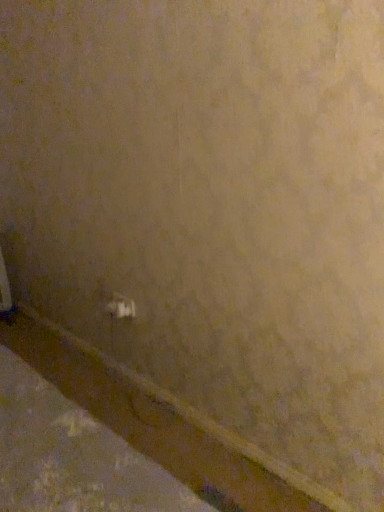
Identify the location of white matte molding at lower left. This screenshot has width=384, height=512. (159, 424).

What do you see at coordinates (159, 424) in the screenshot?
I see `white matte molding at lower left` at bounding box center [159, 424].

Image resolution: width=384 pixels, height=512 pixels. What do you see at coordinates (121, 307) in the screenshot?
I see `white plastic power plugs and sockets at lower center` at bounding box center [121, 307].

The width and height of the screenshot is (384, 512). Identify the location of white plastic power plugs and sockets at lower center. (121, 307).

At what (x,y) coordinates should I click in order to perform the action: click on white matte molding at lower left. Please return your answer as a coordinate pair (x, y). Looking at the image, I should click on (159, 424).

Would you say white matte molding at lower left is to the left or to the right of white plastic power plugs and sockets at lower center in the picture?

white matte molding at lower left is positioned on white plastic power plugs and sockets at lower center's left side.

Which is in front, white matte molding at lower left or white plastic power plugs and sockets at lower center?

white matte molding at lower left is closer to the camera.

Considering the positions of point (167, 403) and point (114, 304), is point (167, 403) closer or farther from the camera than point (114, 304)?

Point (167, 403) is closer to the camera than point (114, 304).

From the image's perspective, who appears lower, white matte molding at lower left or white plastic power plugs and sockets at lower center?

From the image's view, white matte molding at lower left is below.

From a real-world perspective, which is physically below, white matte molding at lower left or white plastic power plugs and sockets at lower center?

white matte molding at lower left, from a real-world perspective.

Considering the relative sizes of white matte molding at lower left and white plastic power plugs and sockets at lower center in the image provided, is white matte molding at lower left wider than white plastic power plugs and sockets at lower center?

Yes, white matte molding at lower left is wider than white plastic power plugs and sockets at lower center.

Is white matte molding at lower left taller than white plastic power plugs and sockets at lower center?

No, white matte molding at lower left is not taller than white plastic power plugs and sockets at lower center.

Is white matte molding at lower left bigger than white plastic power plugs and sockets at lower center?

Yes.

Is white matte molding at lower left completely or partially outside of white plastic power plugs and sockets at lower center?

Indeed, white matte molding at lower left is completely outside white plastic power plugs and sockets at lower center.

Is white matte molding at lower left placed right next to white plastic power plugs and sockets at lower center?

There is a gap between white matte molding at lower left and white plastic power plugs and sockets at lower center.

Is white matte molding at lower left facing towards white plastic power plugs and sockets at lower center?

No.

You are a GUI agent. You are given a task and a screenshot of the screen. Output one action in this format:
    pyautogui.click(x=<x>, y=<y>)
    Task: Click on the molding on the left of white plastic power plugs and sockets at lower center
    This screenshot has width=384, height=512.
    Given the screenshot: What is the action you would take?
    pyautogui.click(x=159, y=424)

Is white plastic power plugs and sockets at lower center to the left of white matte molding at lower left from the viewer's perspective?

No, white plastic power plugs and sockets at lower center is not to the left of white matte molding at lower left.

In the image, is white plastic power plugs and sockets at lower center positioned in front of or behind white matte molding at lower left?

white plastic power plugs and sockets at lower center is behind white matte molding at lower left.

Which point is more forward, (x=127, y=315) or (x=153, y=394)?

The point (x=127, y=315) is more forward.

From the image's perspective, is white plastic power plugs and sockets at lower center under white matte molding at lower left?

Incorrect, from the image's perspective, white plastic power plugs and sockets at lower center is higher than white matte molding at lower left.

From a real-world perspective, which is physically below, white plastic power plugs and sockets at lower center or white matte molding at lower left?

From a 3D spatial view, white matte molding at lower left is below.

Which of these two, white plastic power plugs and sockets at lower center or white matte molding at lower left, is thinner?

Thinner between the two is white plastic power plugs and sockets at lower center.

Can you confirm if white plastic power plugs and sockets at lower center is taller than white matte molding at lower left?

Indeed, white plastic power plugs and sockets at lower center has a greater height compared to white matte molding at lower left.

Considering the relative sizes of white plastic power plugs and sockets at lower center and white matte molding at lower left in the image provided, is white plastic power plugs and sockets at lower center smaller than white matte molding at lower left?

Indeed, white plastic power plugs and sockets at lower center has a smaller size compared to white matte molding at lower left.

Is white plastic power plugs and sockets at lower center not inside white matte molding at lower left?

Yes.

Is there a large distance between white plastic power plugs and sockets at lower center and white matte molding at lower left?

No.

Is white plastic power plugs and sockets at lower center looking in the opposite direction of white matte molding at lower left?

No.

How many degrees apart are the facing directions of white plastic power plugs and sockets at lower center and white matte molding at lower left?

0.0137 degrees separate the facing orientations of white plastic power plugs and sockets at lower center and white matte molding at lower left.

Identify the location of molding that is under the white plastic power plugs and sockets at lower center (from a real-world perspective). (159, 424).

Find the location of a particular element. molding located in front of the white plastic power plugs and sockets at lower center is located at coordinates (159, 424).

Locate an element on the screen. This screenshot has height=512, width=384. molding below the white plastic power plugs and sockets at lower center (from the image's perspective) is located at coordinates (159, 424).